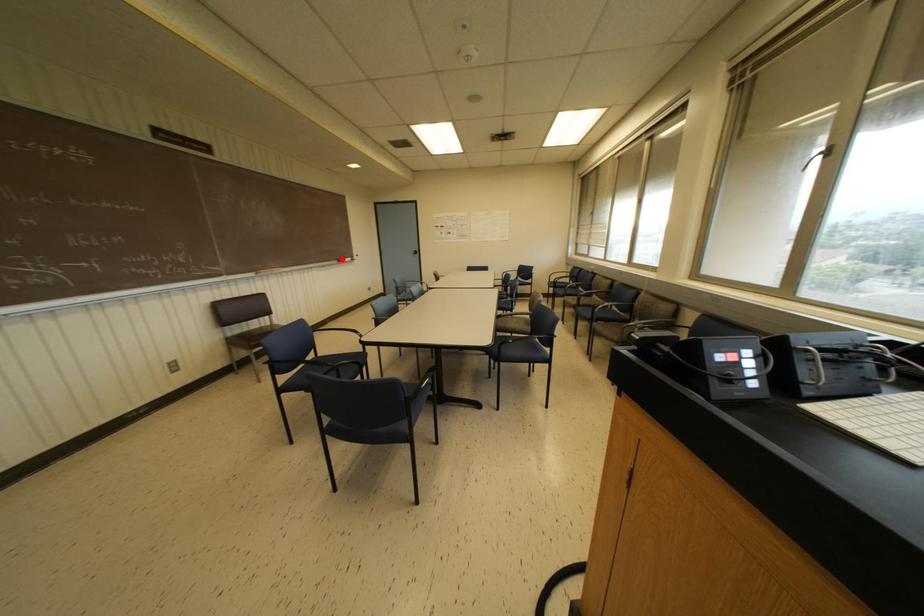
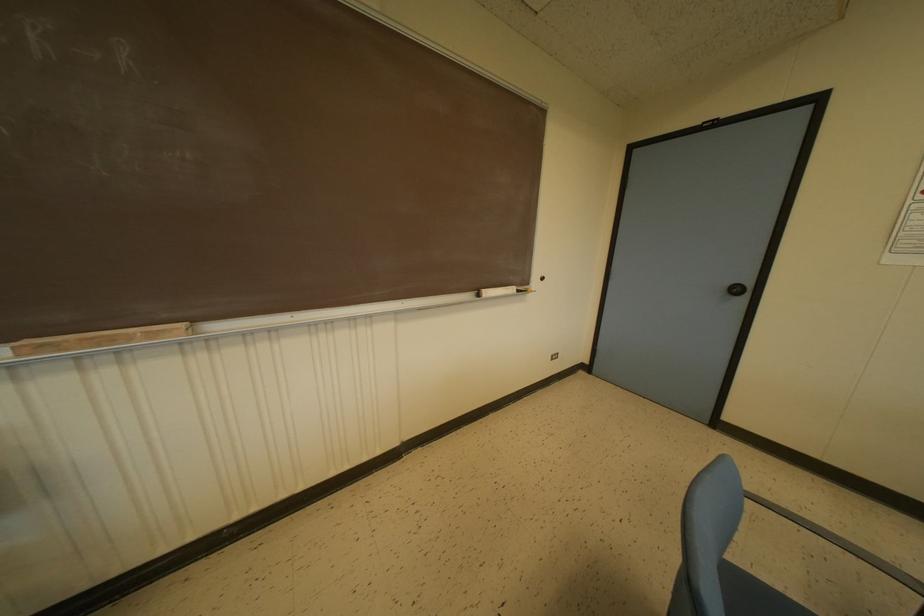
In the second image, find the point that corresponds to the highlighted location in the first image.

(487, 292)